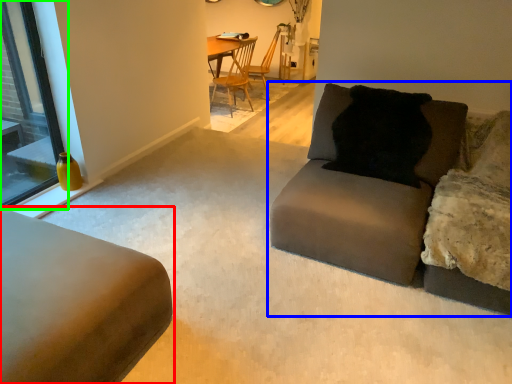
Question: Considering the real-world distances, which object is farthest from studio couch (highlighted by a red box)? studio couch (highlighted by a blue box) or window (highlighted by a green box)?

Choices:
 (A) studio couch
 (B) window

Answer: (B)